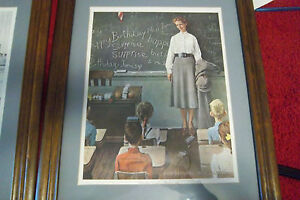
This screenshot has width=300, height=200. Find the location of `chairs`. chairs is located at coordinates (96, 75), (152, 140), (143, 171), (218, 141), (215, 172).